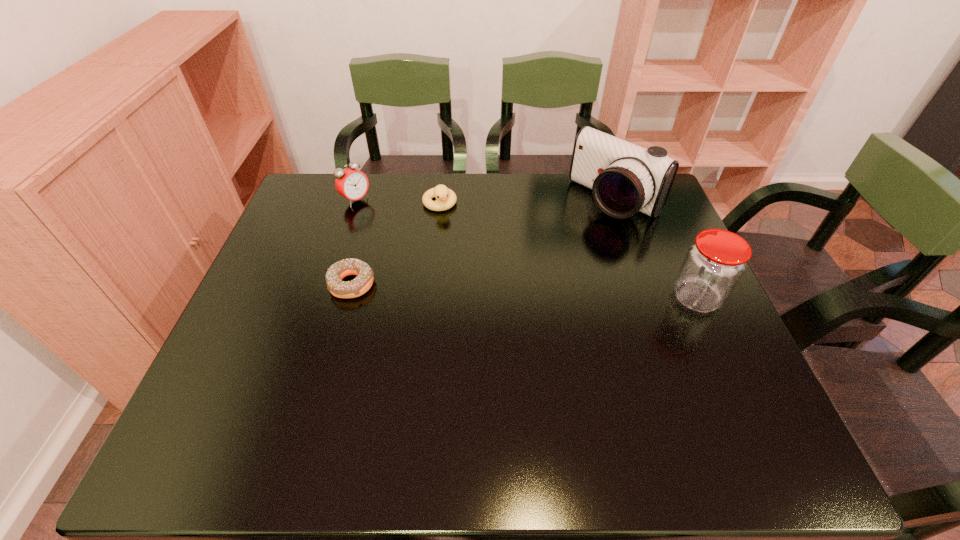
Locate an element on the screen. free space on the desktop that is between the shortest object and the jar and is positioned on the front-facing side of the alarm clock is located at coordinates coord(492,290).

At what (x,y) coordinates should I click in order to perform the action: click on free spot on the desktop that is between the shortest object and the jar and is positioned on the surface of the camcorder. Please return your answer as a coordinate pair (x, y). The width and height of the screenshot is (960, 540). Looking at the image, I should click on tap(509, 291).

Identify the location of free space on the desktop that is between the shortest object and the jar and is positioned at the beak of the third object from left to right. (476, 289).